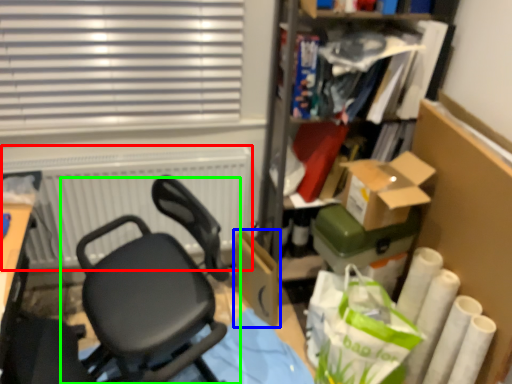
Question: Considering the real-world distances, which object is farthest from radiator (highlighted by a red box)? cardboard box (highlighted by a blue box) or chair (highlighted by a green box)?

Choices:
 (A) cardboard box
 (B) chair

Answer: (A)